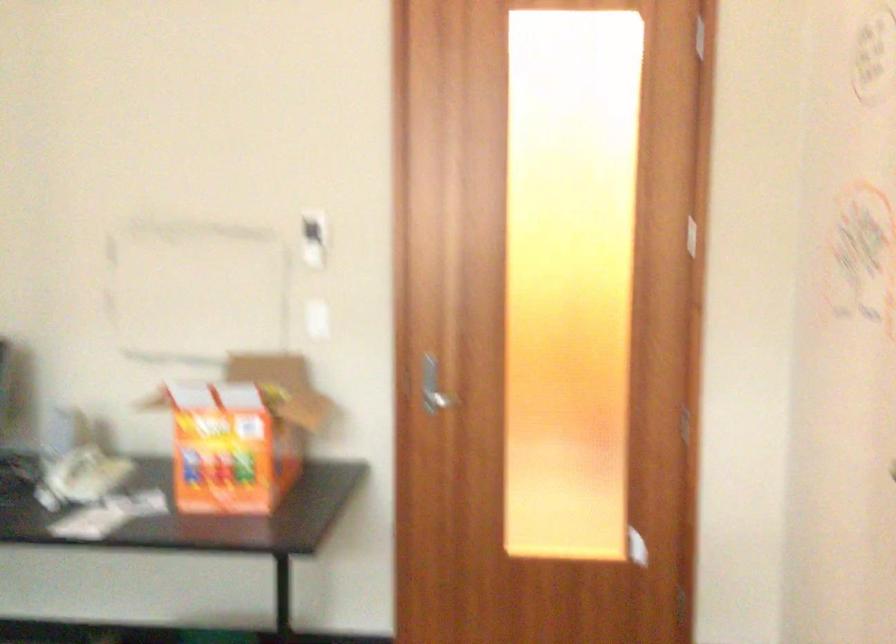
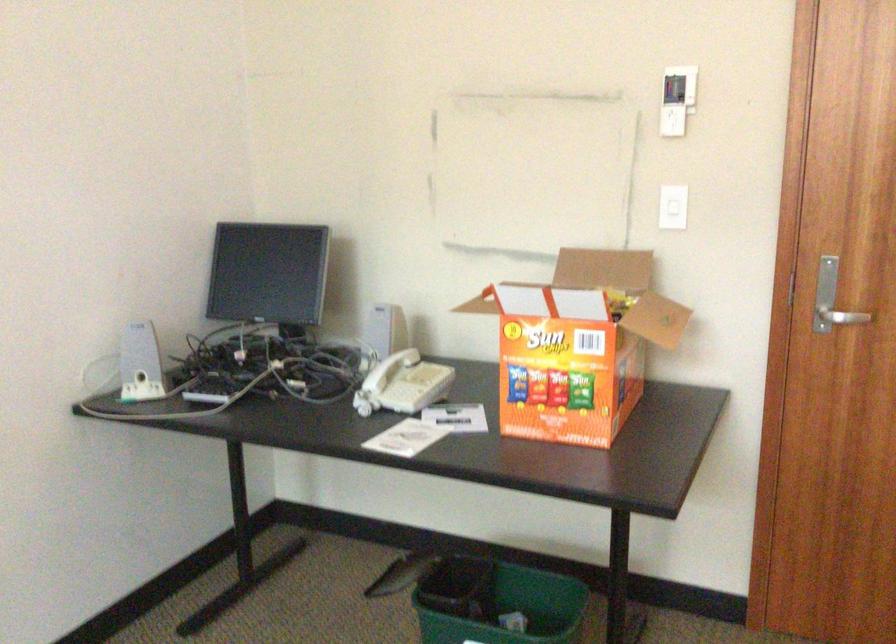
The point at (435, 400) is marked in the first image. Where is the corresponding point in the second image?

(842, 317)